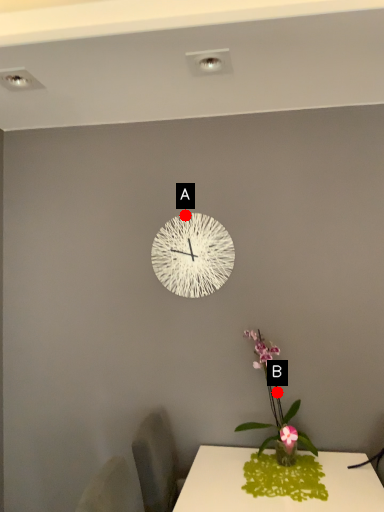
Question: Two points are circled on the image, labeled by A and B beside each circle. Which point is closer to the camera?

Choices:
 (A) A is closer
 (B) B is closer

Answer: (B)